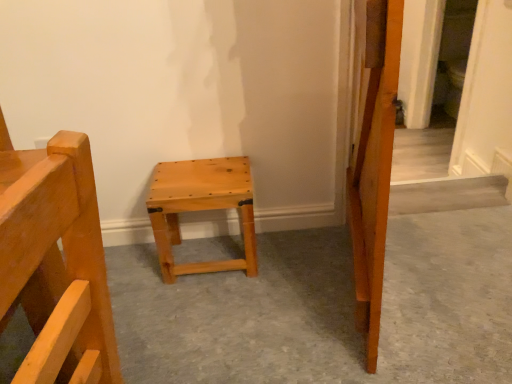
The height and width of the screenshot is (384, 512). In order to click on vacant area situated to the left side of natural wood stool at center in this screenshot , I will do `click(132, 273)`.